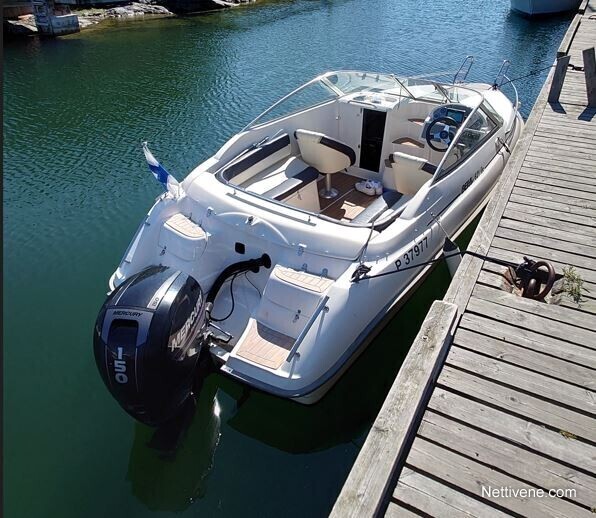
At what (x,y) coordinates should I click in order to perform the action: click on seat. Please return your answer as a coordinate pair (x, y). Image resolution: width=596 pixels, height=518 pixels. Looking at the image, I should click on (330, 151), (403, 166).